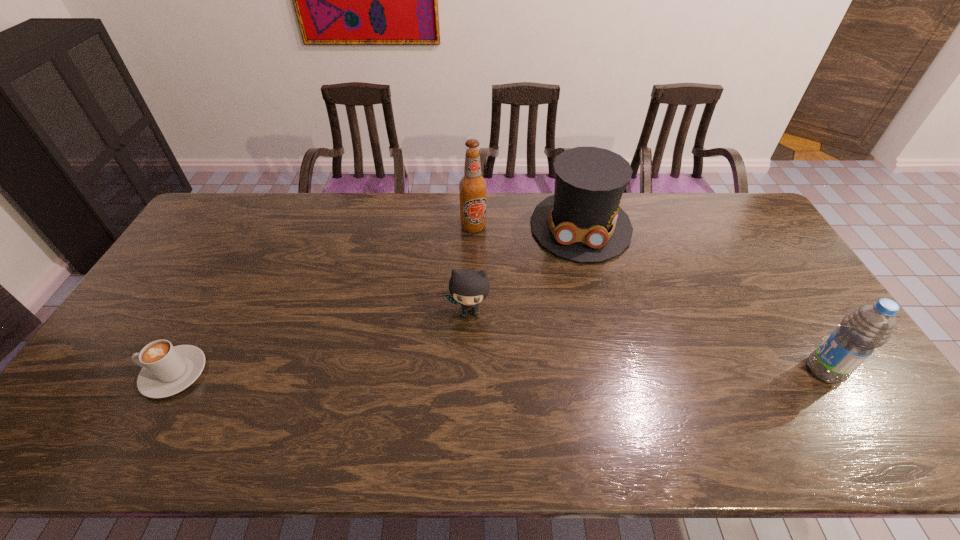
Locate an element on the screen. This screenshot has width=960, height=540. cappuccino that is at the near edge is located at coordinates (167, 370).

You are a GUI agent. You are given a task and a screenshot of the screen. Output one action in this format:
    pyautogui.click(x=<x>, y=<y>)
    Task: Click on the water bottle that is at the near edge
    
    Given the screenshot: What is the action you would take?
    pyautogui.click(x=870, y=326)

You are a GUI agent. You are given a task and a screenshot of the screen. Output one action in this format:
    pyautogui.click(x=<x>, y=<y>)
    Task: Click on the object at the left edge
    
    Given the screenshot: What is the action you would take?
    pyautogui.click(x=167, y=370)

Locate an element on the screen. The image size is (960, 540). object that is at the right edge is located at coordinates (870, 326).

Identify the location of object positioned at the near left corner. This screenshot has width=960, height=540. (167, 370).

At what (x,y) coordinates should I click in order to perform the action: click on object positioned at the near right corner. Please return your answer as a coordinate pair (x, y). The image size is (960, 540). Looking at the image, I should click on [870, 326].

Locate an element on the screen. The height and width of the screenshot is (540, 960). free region at the far edge of the desktop is located at coordinates (450, 200).

What are the coordinates of `vacant area at the near edge of the desktop` in the screenshot? It's located at (199, 379).

Find the location of a particular element. blank space at the left edge is located at coordinates (139, 325).

At what (x,y) coordinates should I click in order to perform the action: click on free space at the right edge of the desktop. Please return your answer as a coordinate pair (x, y). This screenshot has width=960, height=540. Looking at the image, I should click on (764, 276).